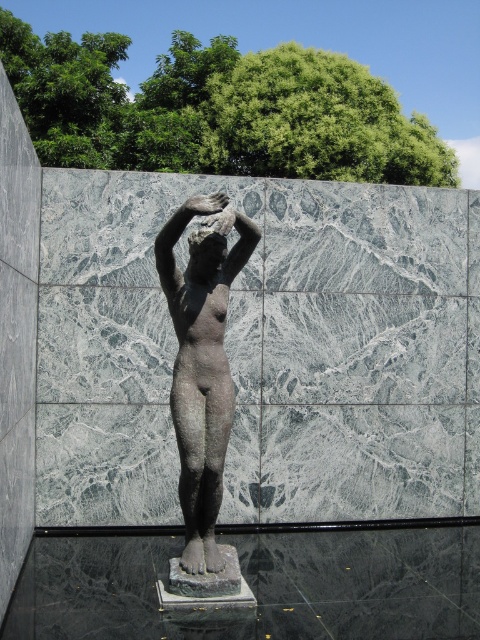
Question: Does bronze statue at center have a smaller size compared to matte bronze head at center?

Choices:
 (A) no
 (B) yes

Answer: (A)

Question: Among these objects, which one is farthest from the camera?

Choices:
 (A) matte bronze head at center
 (B) bronze statue at center

Answer: (A)

Question: Can you confirm if bronze statue at center is wider than matte bronze head at center?

Choices:
 (A) no
 (B) yes

Answer: (B)

Question: Which of the following is the farthest from the observer?

Choices:
 (A) matte bronze head at center
 (B) bronze statue at center

Answer: (A)

Question: Does bronze statue at center have a lesser width compared to matte bronze head at center?

Choices:
 (A) no
 (B) yes

Answer: (A)

Question: Which point is farther to the camera?

Choices:
 (A) (192, 490)
 (B) (223, 260)

Answer: (B)